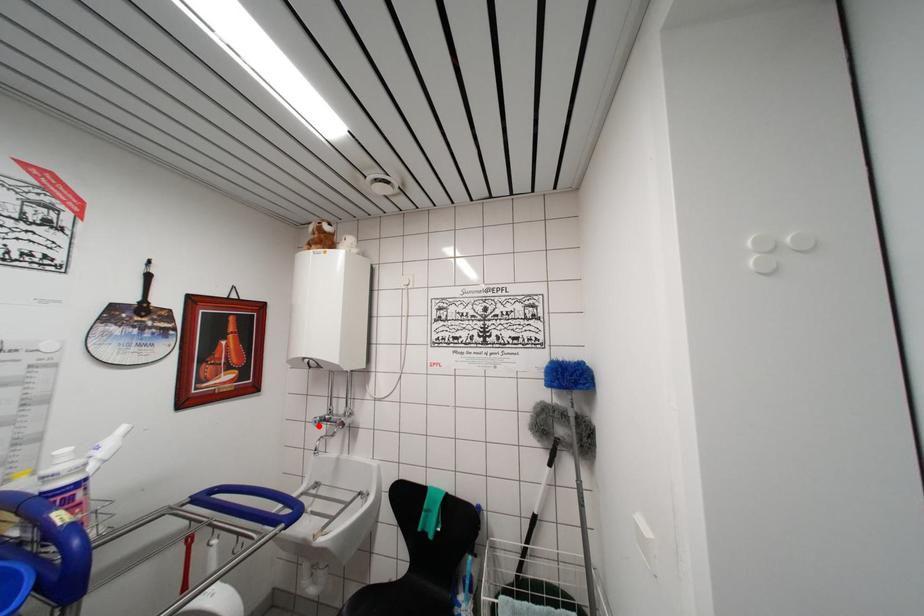
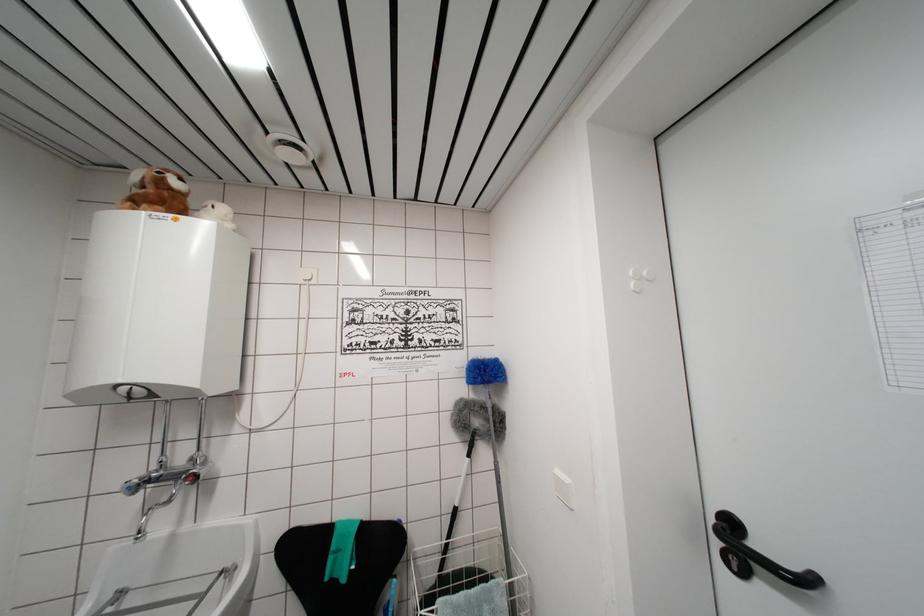
Question: I am providing you with two images of the same scene from different viewpoints. In image1, a red point is highlighted. Considering the same 3D point in image2, which of the following is correct?

Choices:
 (A) It is closer
 (B) It is farther

Answer: (A)